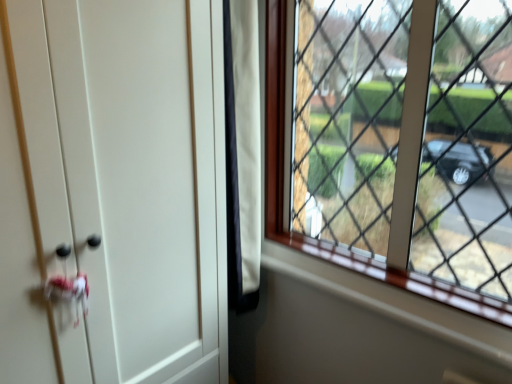
In order to face clear glass window at right, should I rotate leftwards or rightwards?

Turn right approximately 20.066 degrees to face it.

The height and width of the screenshot is (384, 512). Identify the location of clear glass window at right. (326, 240).

This screenshot has height=384, width=512. Describe the element at coordinates (326, 240) in the screenshot. I see `clear glass window at right` at that location.

Where is `clear glass window at right`? This screenshot has width=512, height=384. clear glass window at right is located at coordinates (326, 240).